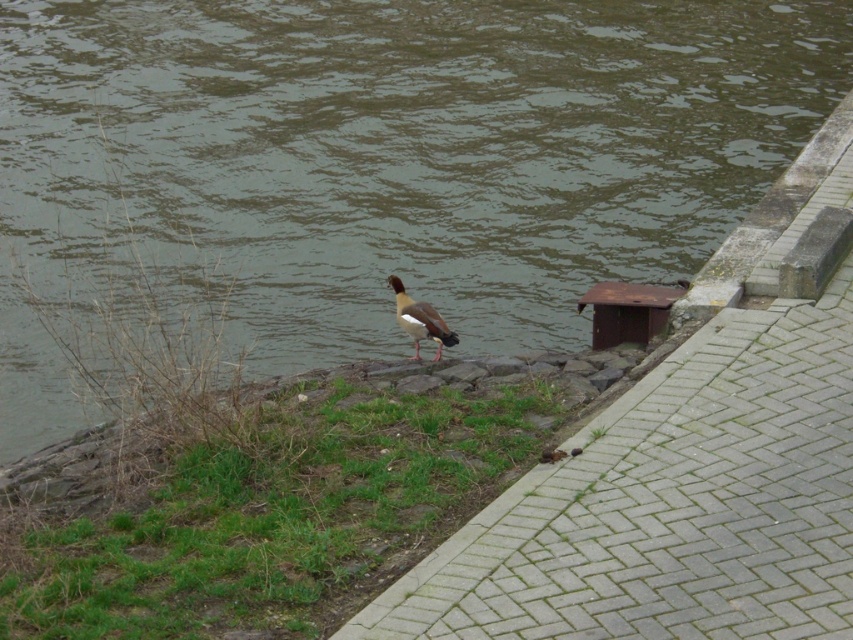
You are standing at point (434,316) and want to walk to point (247,51). Is the path between these two points clear of any obstacles?

Point (247,51) is behind point (434,316), so the path between them is clear of obstacles.

You are standing at the edge of the river and want to place two markers at the coordinates point (405,529) and point (433,314). Which marker will appear closer to you when viewed from your current position?

Point (405,529) is closer to the camera than point (433,314), so the marker at point (405,529) will appear closer to you.

You are a photographer trying to capture a clear shot of the brown feathered duck at center. The brown water at center is reflecting the sky, making it hard to focus. Which object should you adjust your camera focus on to ensure the duck is sharp?

The brown water at center is taller than brown feathered duck at center. To ensure the duck is in focus, adjust your camera focus on the brown feathered duck at center since it is closer to the camera than the taller water.